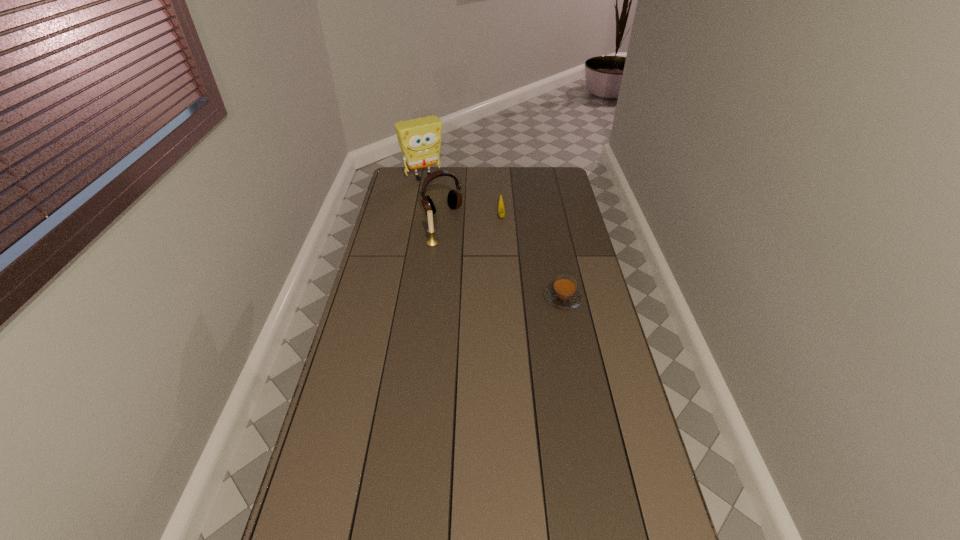
Find the location of a particular element. free space on the desktop that is between the third tallest object and the cappuccino and is positioned at the stem of the banana is located at coordinates (506, 274).

Find the location of a particular element. The image size is (960, 540). vacant space on the desktop that is between the fourth farthest object and the nearest object and is positioned on the face of the sponge is located at coordinates (500, 272).

Locate an element on the screen. This screenshot has height=540, width=960. free space on the desktop that is between the fourth farthest object and the nearest object and is positioned on the ear pads of the fourth shortest object is located at coordinates (476, 262).